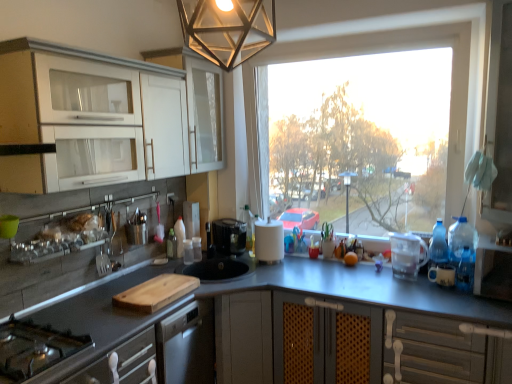
You are a GUI agent. You are given a task and a screenshot of the screen. Output one action in this format:
    pyautogui.click(x=<x>, y=<y>)
    Task: Click on the vacant area on top of black plastic coffee machine at center (from a real-world perspective)
    This screenshot has height=384, width=512.
    Given the screenshot: What is the action you would take?
    point(227,225)